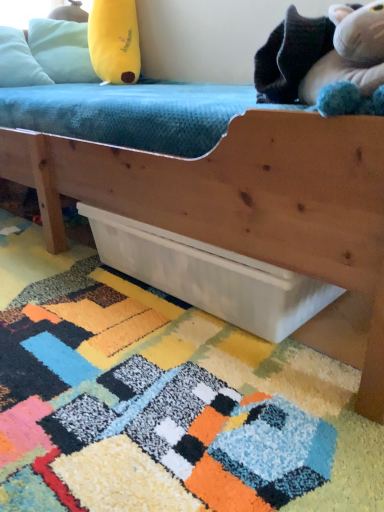
Question: Does fluffy white stuffed animal at upper right, which appears as the 2th toy when viewed from the top, turn towards multicolored shaggy rug at lower center?

Choices:
 (A) yes
 (B) no

Answer: (B)

Question: Is fluffy white stuffed animal at upper right, which appears as the second toy when viewed from the left, thinner than multicolored shaggy rug at lower center?

Choices:
 (A) yes
 (B) no

Answer: (A)

Question: Does fluffy white stuffed animal at upper right, which appears as the second toy when viewed from the left, have a larger size compared to multicolored shaggy rug at lower center?

Choices:
 (A) no
 (B) yes

Answer: (A)

Question: Considering the relative positions of fluffy white stuffed animal at upper right, arranged as the first toy when viewed from the right, and multicolored shaggy rug at lower center in the image provided, is fluffy white stuffed animal at upper right, arranged as the first toy when viewed from the right, behind multicolored shaggy rug at lower center?

Choices:
 (A) no
 (B) yes

Answer: (B)

Question: From the image's perspective, does fluffy white stuffed animal at upper right, which is the 1th toy from bottom to top, appear lower than multicolored shaggy rug at lower center?

Choices:
 (A) no
 (B) yes

Answer: (A)

Question: Is yellow plush toy at upper left, the second toy from the bottom, bigger or smaller than white matte drawer at lower center?

Choices:
 (A) small
 (B) big

Answer: (A)

Question: Is yellow plush toy at upper left, the second toy from the bottom, wider or thinner than white matte drawer at lower center?

Choices:
 (A) thin
 (B) wide

Answer: (A)

Question: Choose the correct answer: Is yellow plush toy at upper left, the 1th toy viewed from the top, inside white matte drawer at lower center or outside it?

Choices:
 (A) inside
 (B) outside

Answer: (B)

Question: From the image's perspective, is yellow plush toy at upper left, positioned as the 1th toy in back-to-front order, positioned above or below white matte drawer at lower center?

Choices:
 (A) below
 (B) above

Answer: (B)

Question: In the image, is light blue fabric pillow at upper left positioned in front of or behind white matte drawer at lower center?

Choices:
 (A) front
 (B) behind

Answer: (B)

Question: Is light blue fabric pillow at upper left situated inside white matte drawer at lower center or outside?

Choices:
 (A) inside
 (B) outside

Answer: (B)

Question: From a real-world perspective, is light blue fabric pillow at upper left physically located above or below white matte drawer at lower center?

Choices:
 (A) above
 (B) below

Answer: (A)

Question: Is light blue fabric pillow at upper left to the left or to the right of white matte drawer at lower center in the image?

Choices:
 (A) right
 (B) left

Answer: (B)

Question: Does point (110, 27) appear closer or farther from the camera than point (0, 56)?

Choices:
 (A) farther
 (B) closer

Answer: (A)

Question: From a real-world perspective, is yellow plush toy at upper left, positioned as the 2th toy in front-to-back order, physically located above or below light blue fabric pillow at upper left?

Choices:
 (A) below
 (B) above

Answer: (A)